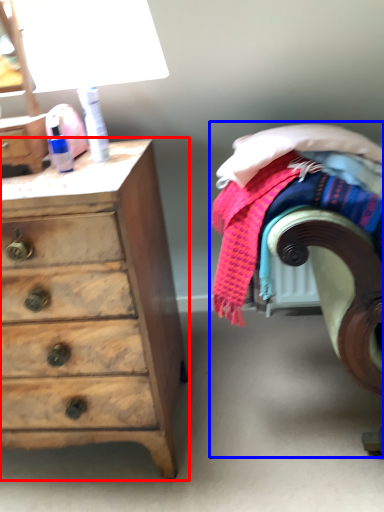
Question: Among these objects, which one is farthest to the camera, chest of drawers (highlighted by a red box) or bed (highlighted by a blue box)?

Choices:
 (A) chest of drawers
 (B) bed

Answer: (A)